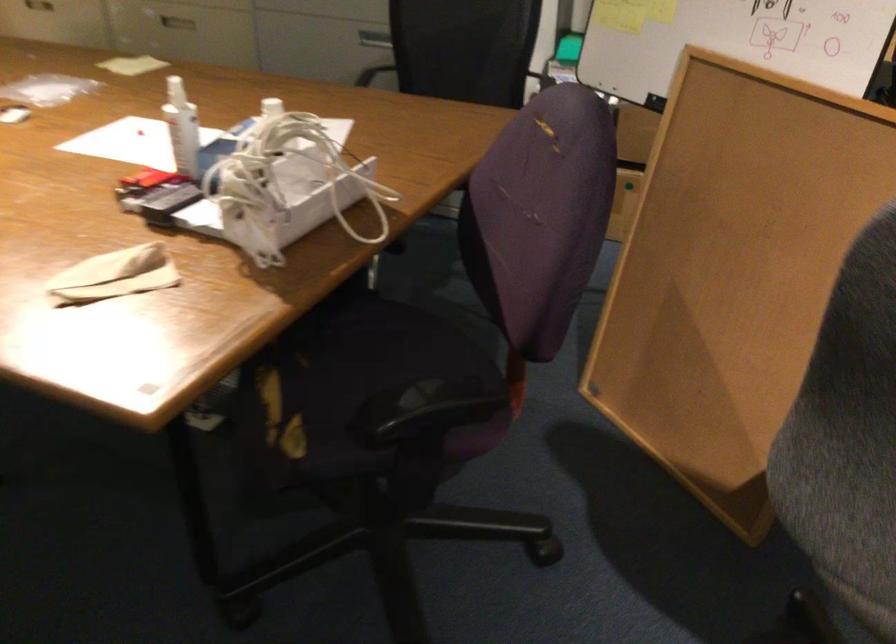
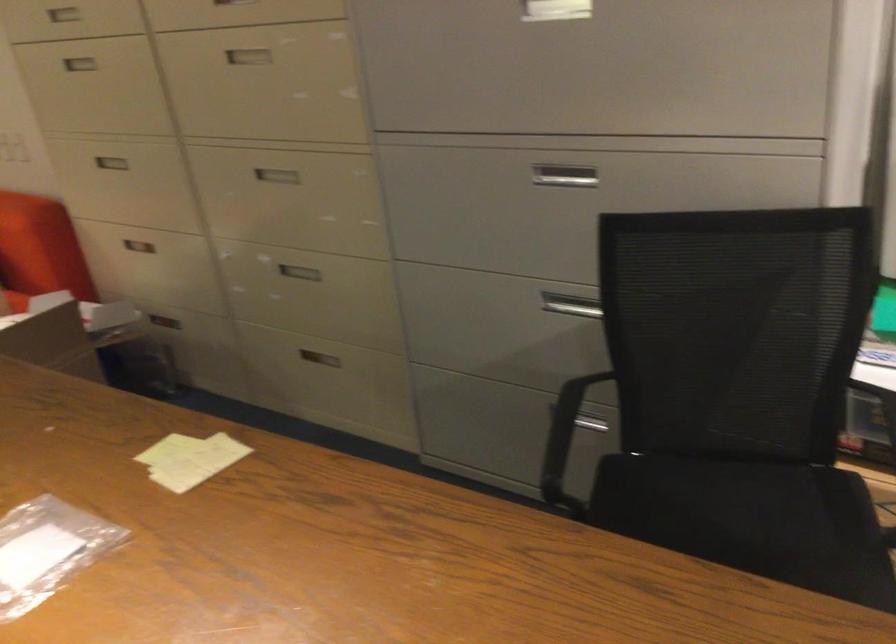
Question: The images are taken continuously from a first-person perspective. In which direction are you moving?

Choices:
 (A) Left
 (B) Right
 (C) Forward
 (D) Backward

Answer: (C)